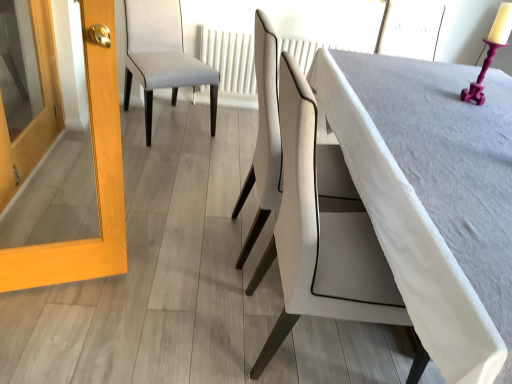
I want to click on light wood frame at left, so click(x=95, y=178).

Considering the sizes of light gray fabric chair at upper left, which is the second chair in right-to-left order, and light wood frame at left in the image, is light gray fabric chair at upper left, which is the second chair in right-to-left order, taller or shorter than light wood frame at left?

In the image, light gray fabric chair at upper left, which is the second chair in right-to-left order, appears to be shorter than light wood frame at left.

From the image's perspective, would you say light gray fabric chair at upper left, which is the first chair in left-to-right order, is shown under light wood frame at left?

No, from the image's perspective, light gray fabric chair at upper left, which is the first chair in left-to-right order, is not below light wood frame at left.

Can you tell me how much light gray fabric chair at upper left, which appears as the second chair when viewed from the front, and light wood frame at left differ in facing direction?

The facing directions of light gray fabric chair at upper left, which appears as the second chair when viewed from the front, and light wood frame at left are 13.1 degrees apart.

Locate an element on the screen. screen door located above the light gray fabric chair at upper left, which appears as the second chair when viewed from the front (from a real-world perspective) is located at coordinates (95, 178).

I want to click on the 1st chair above when counting from the smooth gray table at center (from the image's perspective), so click(x=264, y=135).

From the picture: Is white leather chair at center, which is the first chair in front-to-back order, outside of smooth gray table at center?

Indeed, white leather chair at center, which is the first chair in front-to-back order, is completely outside smooth gray table at center.

Who is shorter, white leather chair at center, the second chair when ordered from back to front, or smooth gray table at center?

Standing shorter between the two is smooth gray table at center.

From a real-world perspective, is white leather chair at center, the second chair when ordered from back to front, positioned under light wood frame at left based on gravity?

Yes.

In the scene shown: In terms of size, does white leather chair at center, the second chair when ordered from back to front, appear bigger or smaller than light wood frame at left?

Considering their sizes, white leather chair at center, the second chair when ordered from back to front, takes up more space than light wood frame at left.

Considering their positions, is white leather chair at center, the second chair when ordered from back to front, located in front of or behind light wood frame at left?

white leather chair at center, the second chair when ordered from back to front, is positioned farther from the viewer than light wood frame at left.

Considering the points (277, 105) and (116, 76), which point is in front, point (277, 105) or point (116, 76)?

The point (277, 105) is in front.

You are a GUI agent. You are given a task and a screenshot of the screen. Output one action in this format:
    pyautogui.click(x=<x>, y=<y>)
    Task: Click on the chair that is the 1st one when counting forward from the white textured radiator at center
    This screenshot has width=512, height=384.
    Given the screenshot: What is the action you would take?
    (x=162, y=56)

How many degrees apart are the facing directions of light gray fabric chair at upper left, the 1th chair viewed from the back, and white textured radiator at center?

30.9 degrees separate the facing orientations of light gray fabric chair at upper left, the 1th chair viewed from the back, and white textured radiator at center.

From the picture: Which object is thinner, light gray fabric chair at upper left, the 1th chair viewed from the back, or white textured radiator at center?

Thinner between the two is white textured radiator at center.

Which is more to the left, light gray fabric chair at upper left, which appears as the second chair when viewed from the front, or white textured radiator at center?

light gray fabric chair at upper left, which appears as the second chair when viewed from the front.

Could you tell me if white textured radiator at center is turned towards white leather chair at center, the second chair when ordered from back to front?

Yes.

Considering the sizes of white textured radiator at center and white leather chair at center, the second chair when ordered from back to front, in the image, is white textured radiator at center wider or thinner than white leather chair at center, the second chair when ordered from back to front,?

Considering their sizes, white textured radiator at center looks slimmer than white leather chair at center, the second chair when ordered from back to front.

In the scene shown: From a real-world perspective, between white textured radiator at center and white leather chair at center, which is the first chair in front-to-back order, who is vertically higher?

In real-world perspective, white leather chair at center, which is the first chair in front-to-back order, is above.

Considering the sizes of objects white textured radiator at center and white leather chair at center, the 2th chair in the left-to-right sequence, in the image provided, who is shorter, white textured radiator at center or white leather chair at center, the 2th chair in the left-to-right sequence,?

white textured radiator at center.

Considering the relative positions of light gray fabric chair at upper left, which is the second chair in right-to-left order, and white leather chair at center, which is the first chair from right to left, in the image provided, is light gray fabric chair at upper left, which is the second chair in right-to-left order, behind white leather chair at center, which is the first chair from right to left,?

Yes, light gray fabric chair at upper left, which is the second chair in right-to-left order, is further from the camera.

Which object is wider, light gray fabric chair at upper left, which appears as the second chair when viewed from the front, or white leather chair at center, the second chair when ordered from back to front?

light gray fabric chair at upper left, which appears as the second chair when viewed from the front.

Are light gray fabric chair at upper left, the 1th chair viewed from the back, and white leather chair at center, the second chair when ordered from back to front, making contact?

light gray fabric chair at upper left, the 1th chair viewed from the back, is not next to white leather chair at center, the second chair when ordered from back to front, and they're not touching.

Is white textured radiator at center to the right of light gray fabric chair at upper left, the 1th chair viewed from the back, from the viewer's perspective?

Correct, you'll find white textured radiator at center to the right of light gray fabric chair at upper left, the 1th chair viewed from the back.

Is point (233, 73) more distant than point (145, 64)?

Yes, it is behind point (145, 64).

From the picture: Does white textured radiator at center have a lesser height compared to light gray fabric chair at upper left, which is the first chair in left-to-right order?

Indeed, white textured radiator at center has a lesser height compared to light gray fabric chair at upper left, which is the first chair in left-to-right order.

Is white textured radiator at center turned away from light gray fabric chair at upper left, which is the second chair in right-to-left order?

No, light gray fabric chair at upper left, which is the second chair in right-to-left order, is not at the back of white textured radiator at center.

Locate an element on the screen. Image resolution: width=512 pixels, height=384 pixels. screen door that appears below the light gray fabric chair at upper left, which appears as the second chair when viewed from the front (from the image's perspective) is located at coordinates (95, 178).

Image resolution: width=512 pixels, height=384 pixels. I want to click on the 1st chair behind when counting from the smooth gray table at center, so pos(264,135).

When comparing their distances from light wood frame at left, does white textured radiator at center or light gray fabric chair at upper left, which appears as the second chair when viewed from the front, seem closer?

light gray fabric chair at upper left, which appears as the second chair when viewed from the front, lies closer to light wood frame at left than the other object.

Based on their spatial positions, is light wood frame at left or smooth gray table at center closer to white leather chair at center, which is the first chair from right to left?

light wood frame at left.

Looking at the image, which one is located closer to white textured radiator at center, light gray fabric chair at upper left, the 1th chair viewed from the back, or white leather chair at center, the second chair when ordered from back to front?

light gray fabric chair at upper left, the 1th chair viewed from the back, is positioned closer to the anchor white textured radiator at center.

Estimate the real-world distances between objects in this image. Which object is further from white leather chair at center, the second chair when ordered from back to front, light gray fabric chair at upper left, which appears as the second chair when viewed from the front, or white textured radiator at center?

white textured radiator at center is further to white leather chair at center, the second chair when ordered from back to front.

When comparing their distances from light gray fabric chair at upper left, which is the second chair in right-to-left order, does light wood frame at left or white textured radiator at center seem closer?

white textured radiator at center lies closer to light gray fabric chair at upper left, which is the second chair in right-to-left order, than the other object.

Estimate the real-world distances between objects in this image. Which object is further from smooth gray table at center, light gray fabric chair at upper left, the 1th chair viewed from the back, or light wood frame at left?

Based on the image, light gray fabric chair at upper left, the 1th chair viewed from the back, appears to be further to smooth gray table at center.

Based on the photo, from the image, which object appears to be nearer to light wood frame at left, smooth gray table at center or white leather chair at center, the 2th chair in the left-to-right sequence?

white leather chair at center, the 2th chair in the left-to-right sequence, is positioned closer to the anchor light wood frame at left.

Based on their spatial positions, is white textured radiator at center or white leather chair at center, the second chair when ordered from back to front, closer to light wood frame at left?

white leather chair at center, the second chair when ordered from back to front, is positioned closer to the anchor light wood frame at left.

Identify the location of chair between light wood frame at left and light gray fabric chair at upper left, which is the first chair in left-to-right order, from front to back. This screenshot has width=512, height=384. (x=264, y=135).

Locate an element on the screen. Image resolution: width=512 pixels, height=384 pixels. chair located between white leather chair at center, the second chair when ordered from back to front, and white textured radiator at center in the depth direction is located at coordinates (162, 56).

Where is `screen door between smooth gray table at center and white textured radiator at center in the front-back direction`? The image size is (512, 384). screen door between smooth gray table at center and white textured radiator at center in the front-back direction is located at coordinates (95, 178).

The width and height of the screenshot is (512, 384). Identify the location of chair located between smooth gray table at center and light gray fabric chair at upper left, the 1th chair viewed from the back, in the depth direction. pos(264,135).